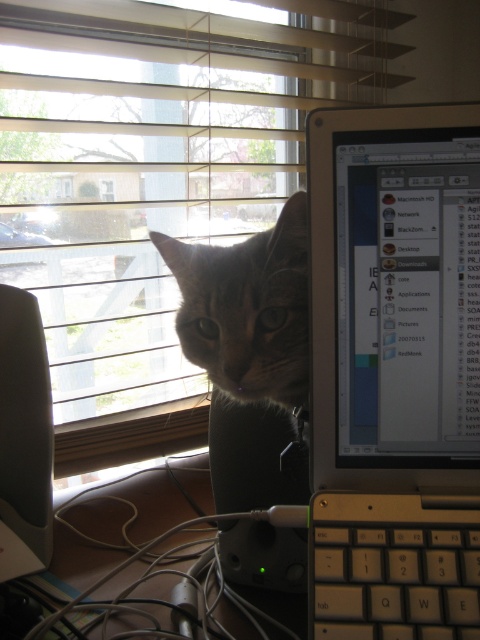
You are organizing your workspace and want to move the tabby fur cat at center to the left side of the brown wood computer desk at lower center. Based on their current positions, is this possible without moving the desk?

The tabby fur cat at center is currently to the right of the brown wood computer desk at lower center, so moving it to the left side of the desk is possible without moving the desk itself.

You are trying to clean the transparent glass window at center but need to avoid the wooden blinds at upper center. Which side of the window should you clean first to avoid the blinds?

The wooden blinds at upper center is positioned on the right side of transparent glass window at center, so you should clean the left side of the transparent glass window at center first to avoid the blinds.

In the scene shown: You are a delivery robot with a package that is 14 inches wide. You need to place it between the white plastic laptop at right and the satin black monitor at left. Is there enough space for the package?

The distance between the white plastic laptop at right and the satin black monitor at left is 13.41 inches. Since the package is 14 inches wide, it is wider than the available space. Therefore, the package cannot fit between them.